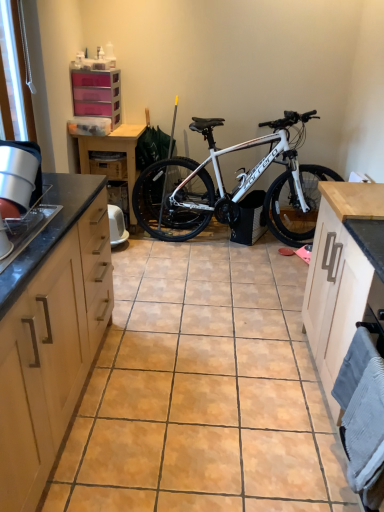
The image size is (384, 512). I want to click on free space that is to the left of light wood cabinet at right, positioned as the 1th cabinetry in right-to-left order, so click(240, 383).